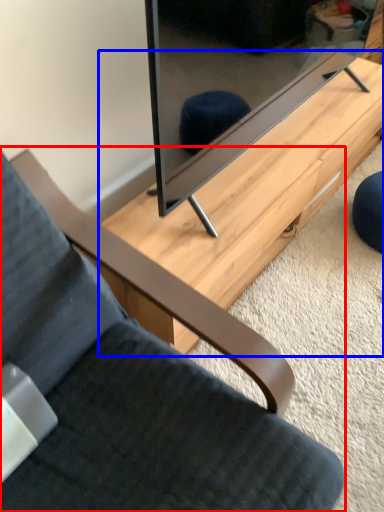
Question: Which of the following is the farthest to the observer, chair (highlighted by a red box) or table (highlighted by a blue box)?

Choices:
 (A) chair
 (B) table

Answer: (B)